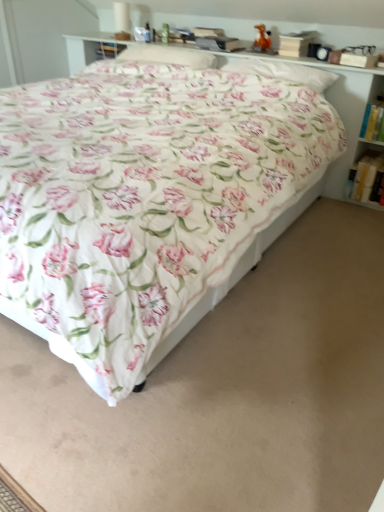
Question: Would you consider floral fabric pillow at upper center, arranged as the second pillow when viewed from the left, to be distant from white paper book at right, placed as the second book when sorted from top to bottom?

Choices:
 (A) no
 (B) yes

Answer: (A)

Question: Is white paper book at right, which is the 1th book in bottom-to-top order, inside floral fabric pillow at upper center, arranged as the second pillow when viewed from the left?

Choices:
 (A) no
 (B) yes

Answer: (A)

Question: Does floral fabric pillow at upper center, arranged as the second pillow when viewed from the left, have a lesser height compared to white paper book at right, placed as the second book when sorted from top to bottom?

Choices:
 (A) no
 (B) yes

Answer: (B)

Question: Is floral fabric pillow at upper center, arranged as the second pillow when viewed from the left, positioned with its back to white paper book at right, placed as the second book when sorted from top to bottom?

Choices:
 (A) no
 (B) yes

Answer: (A)

Question: Is floral fabric pillow at upper center, the first pillow in the right-to-left sequence, oriented towards white paper book at right, which is the 1th book in bottom-to-top order?

Choices:
 (A) no
 (B) yes

Answer: (A)

Question: Are floral fabric pillow at upper center, the first pillow in the right-to-left sequence, and white paper book at right, placed as the second book when sorted from top to bottom, beside each other?

Choices:
 (A) yes
 (B) no

Answer: (B)

Question: Considering the relative positions of white paper book at right, which is the 1th book in bottom-to-top order, and floral fabric pillow at upper center, the first pillow in the right-to-left sequence, in the image provided, is white paper book at right, which is the 1th book in bottom-to-top order, in front of floral fabric pillow at upper center, the first pillow in the right-to-left sequence,?

Choices:
 (A) yes
 (B) no

Answer: (B)

Question: Does white paper book at right, which is the 1th book in bottom-to-top order, have a greater width compared to floral fabric pillow at upper center, arranged as the second pillow when viewed from the left?

Choices:
 (A) no
 (B) yes

Answer: (B)

Question: Can you confirm if white paper book at right, placed as the second book when sorted from top to bottom, is positioned to the left of floral fabric pillow at upper center, the first pillow in the right-to-left sequence?

Choices:
 (A) yes
 (B) no

Answer: (B)

Question: From a real-world perspective, is white paper book at right, which is the 1th book in bottom-to-top order, located higher than floral fabric pillow at upper center, the first pillow in the right-to-left sequence?

Choices:
 (A) yes
 (B) no

Answer: (B)

Question: Is floral fabric pillow at upper center, arranged as the second pillow when viewed from the left, surrounded by white paper book at right, which is the 1th book in bottom-to-top order?

Choices:
 (A) yes
 (B) no

Answer: (B)

Question: From a real-world perspective, is white paper book at right, placed as the second book when sorted from top to bottom, physically below floral fabric pillow at upper center, the first pillow in the right-to-left sequence?

Choices:
 (A) no
 (B) yes

Answer: (B)

Question: Is white soft pillow at upper center, the 2th pillow positioned from the right, closer to the viewer compared to floral fabric pillow at upper center, the first pillow in the right-to-left sequence?

Choices:
 (A) no
 (B) yes

Answer: (A)